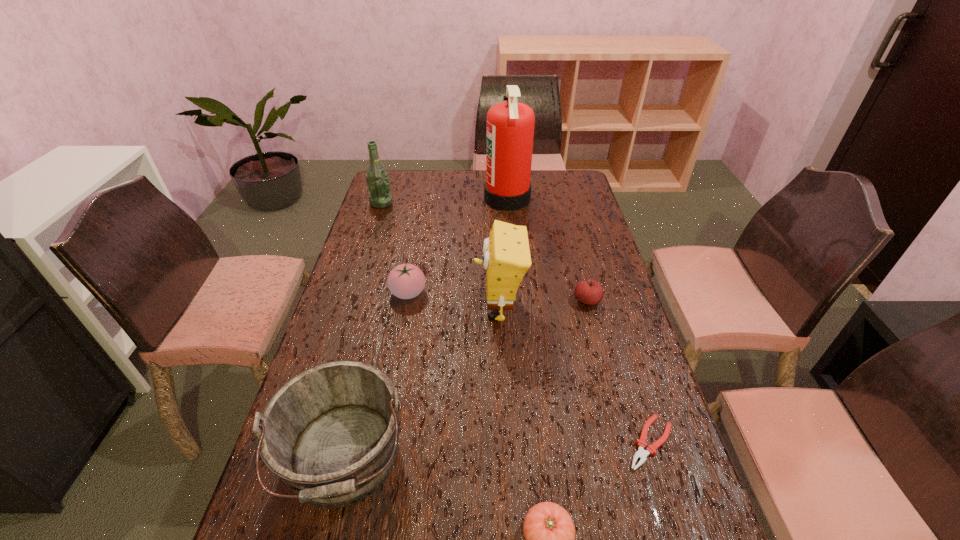
In the image, there is a desktop. Identify the location of vacant space at the far right corner. (575, 177).

In order to click on vacant area that lies between the sponge and the tallest tomato in this screenshot , I will do `click(453, 301)`.

Locate an element on the screen. vacant point located between the beer bottle and the fire extinguisher is located at coordinates (444, 201).

This screenshot has height=540, width=960. Identify the location of vacant point located between the tallest object and the beer bottle. (444, 201).

Find the location of a particular element. free space between the leftmost tomato and the pliers is located at coordinates (529, 368).

This screenshot has height=540, width=960. I want to click on free space that is in between the wine bucket and the fire extinguisher, so click(x=426, y=329).

Where is `empty space between the fourth shortest object and the sponge`? empty space between the fourth shortest object and the sponge is located at coordinates (453, 301).

You are a GUI agent. You are given a task and a screenshot of the screen. Output one action in this format:
    pyautogui.click(x=<x>, y=<y>)
    Task: Click on the object that ranks as the fourth closest to the tallest tomato
    The width and height of the screenshot is (960, 540).
    Given the screenshot: What is the action you would take?
    pyautogui.click(x=378, y=185)

This screenshot has height=540, width=960. In order to click on object that ranks as the fifth closest to the fire extinguisher in this screenshot , I will do `click(330, 433)`.

Identify which tomato is the second closest to the rightmost tomato. Please provide its 2D coordinates. Your answer should be formatted as a tuple, i.e. [(x, y)], where the tuple contains the x and y coordinates of a point satisfying the conditions above.

[(549, 531)]